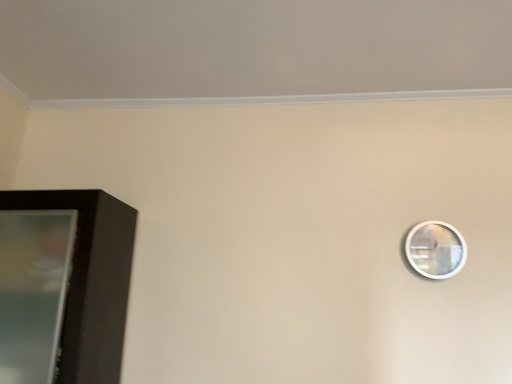
Question: Should I look upward or downward to see silver metallic mirror at upper right?

Choices:
 (A) up
 (B) down

Answer: (B)

Question: Should I look upward or downward to see black glossy cabinet at left?

Choices:
 (A) up
 (B) down

Answer: (B)

Question: Is black glossy cabinet at left to the left of silver metallic mirror at upper right from the viewer's perspective?

Choices:
 (A) yes
 (B) no

Answer: (A)

Question: Is the position of black glossy cabinet at left more distant than that of silver metallic mirror at upper right?

Choices:
 (A) no
 (B) yes

Answer: (A)

Question: From a real-world perspective, is black glossy cabinet at left physically below silver metallic mirror at upper right?

Choices:
 (A) no
 (B) yes

Answer: (B)

Question: Does black glossy cabinet at left have a greater height compared to silver metallic mirror at upper right?

Choices:
 (A) no
 (B) yes

Answer: (B)

Question: Can you confirm if black glossy cabinet at left is thinner than silver metallic mirror at upper right?

Choices:
 (A) yes
 (B) no

Answer: (B)

Question: From the image's perspective, is black glossy cabinet at left located above silver metallic mirror at upper right?

Choices:
 (A) yes
 (B) no

Answer: (B)

Question: Could you tell me if silver metallic mirror at upper right is turned towards black glossy cabinet at left?

Choices:
 (A) no
 (B) yes

Answer: (A)

Question: Is silver metallic mirror at upper right at the left side of black glossy cabinet at left?

Choices:
 (A) no
 (B) yes

Answer: (A)

Question: Considering the relative sizes of silver metallic mirror at upper right and black glossy cabinet at left in the image provided, is silver metallic mirror at upper right shorter than black glossy cabinet at left?

Choices:
 (A) no
 (B) yes

Answer: (B)

Question: From a real-world perspective, is silver metallic mirror at upper right under black glossy cabinet at left?

Choices:
 (A) yes
 (B) no

Answer: (B)

Question: Is silver metallic mirror at upper right facing away from black glossy cabinet at left?

Choices:
 (A) no
 (B) yes

Answer: (A)

Question: Is silver metallic mirror at upper right wider than black glossy cabinet at left?

Choices:
 (A) no
 (B) yes

Answer: (A)

Question: From the image's perspective, is black glossy cabinet at left positioned above or below silver metallic mirror at upper right?

Choices:
 (A) above
 (B) below

Answer: (B)